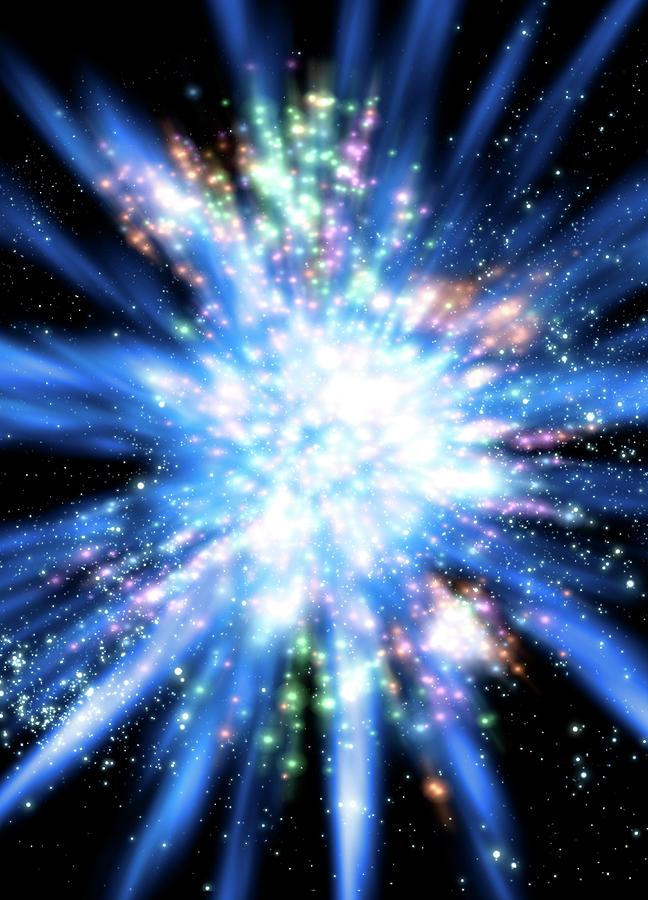
Where is `orange glowing light`? The image size is (648, 900). orange glowing light is located at coordinates (439, 792).